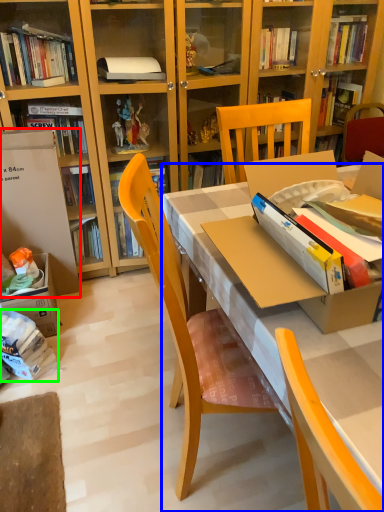
Question: Based on their relative distances, which object is farther from leftover (highlighted by a red box)? Choose from desk (highlighted by a blue box) and book (highlighted by a green box).

Choices:
 (A) desk
 (B) book

Answer: (A)